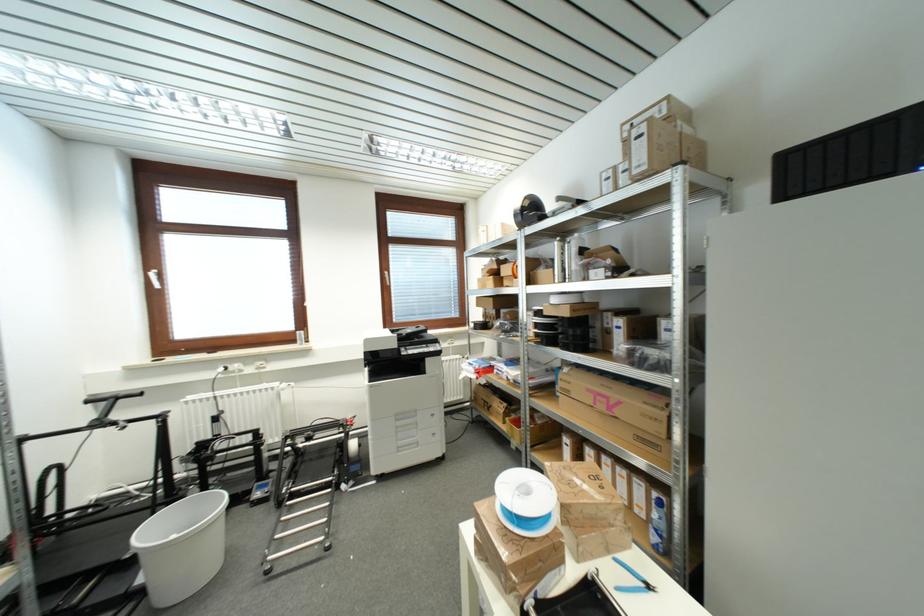
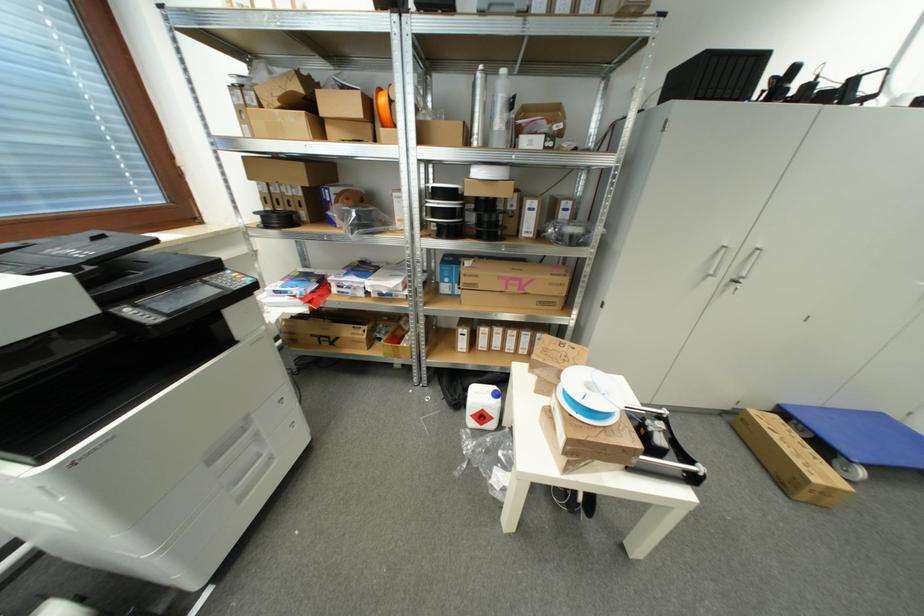
In the second image, find the point that corresponds to (509,407) in the first image.

(370, 330)